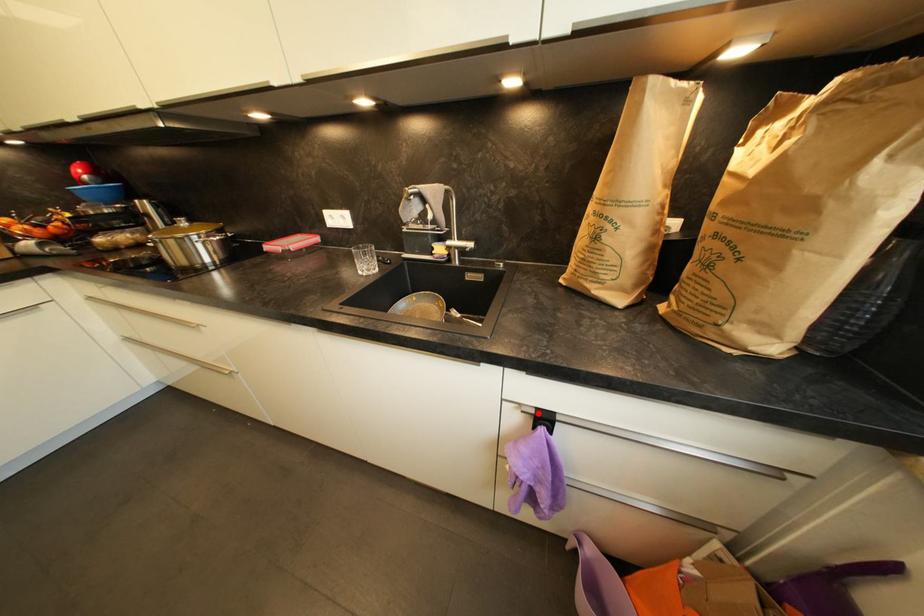
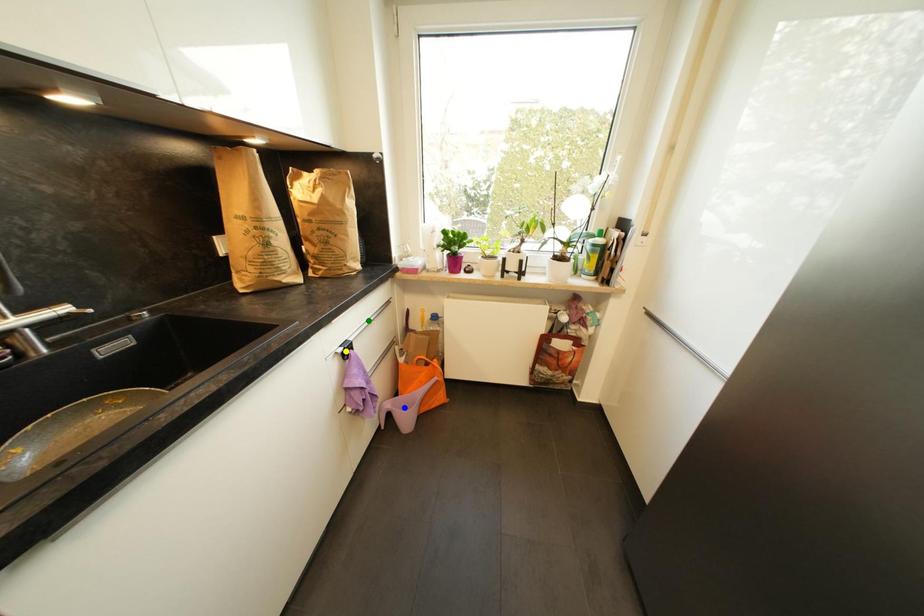
Question: I am providing you with two images of the same scene from different viewpoints. A red point is marked on the first image. You are given multiple points on the second image. Can you choose the point in image 2 that corresponds to the point in image 1?

Choices:
 (A) green point
 (B) yellow point
 (C) blue point

Answer: (B)